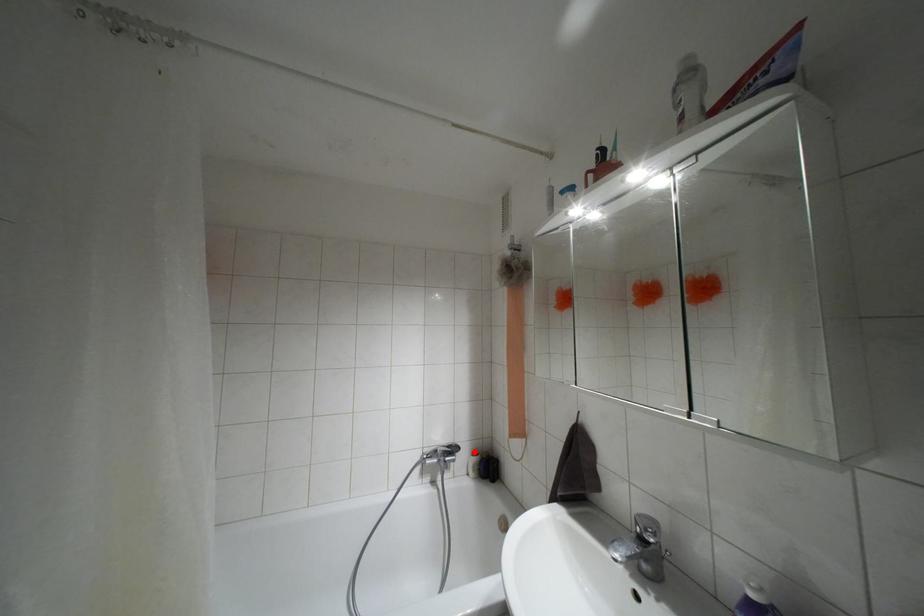
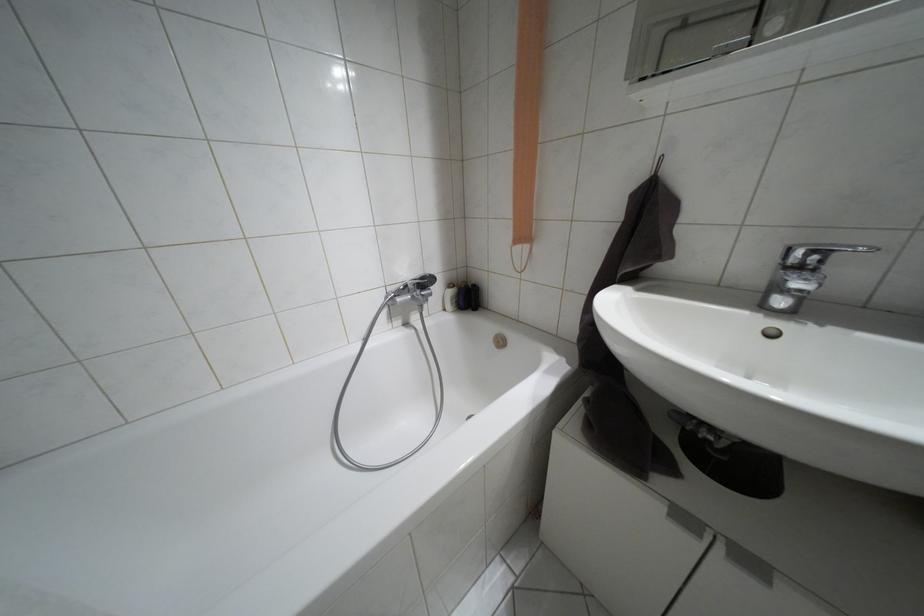
In the second image, find the point that corresponds to the highlighted location in the first image.

(448, 285)